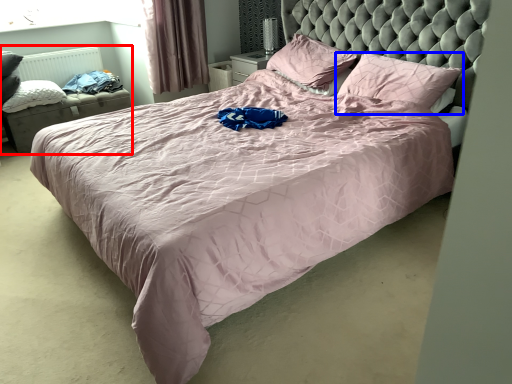
Question: Which object is closer to the camera taking this photo, bed frame (highlighted by a red box) or pillow (highlighted by a blue box)?

Choices:
 (A) bed frame
 (B) pillow

Answer: (B)